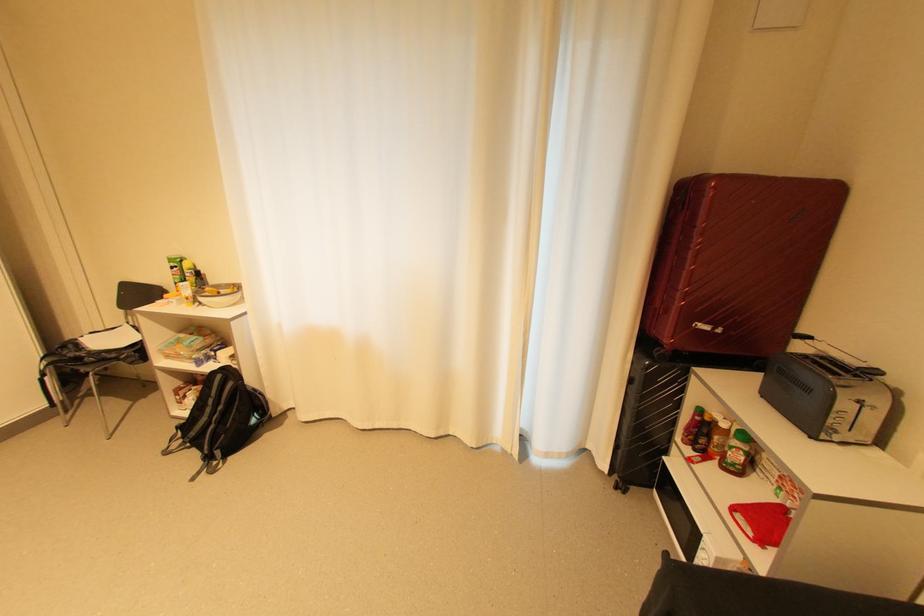
At what (x,y) coordinates should I click in order to perform the action: click on chair sitting surface. Please return your answer as a coordinate pair (x, y). Looking at the image, I should click on (102, 347).